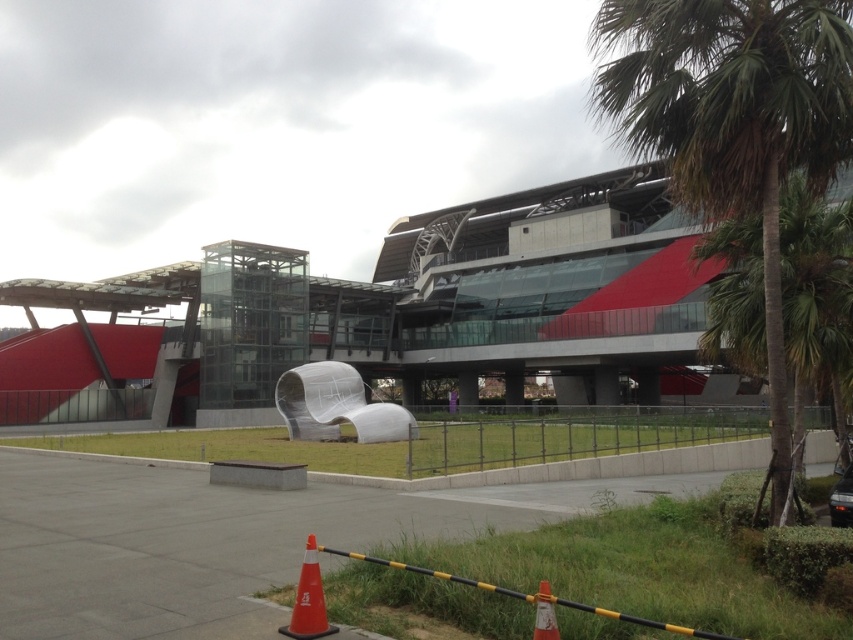
You are standing at the entrance of the station and see the green leafy palm tree at right and the orange matte cone at lower center. Which object is located to the right of the other?

The green leafy palm tree at right is positioned on the right side of orange matte cone at lower center.